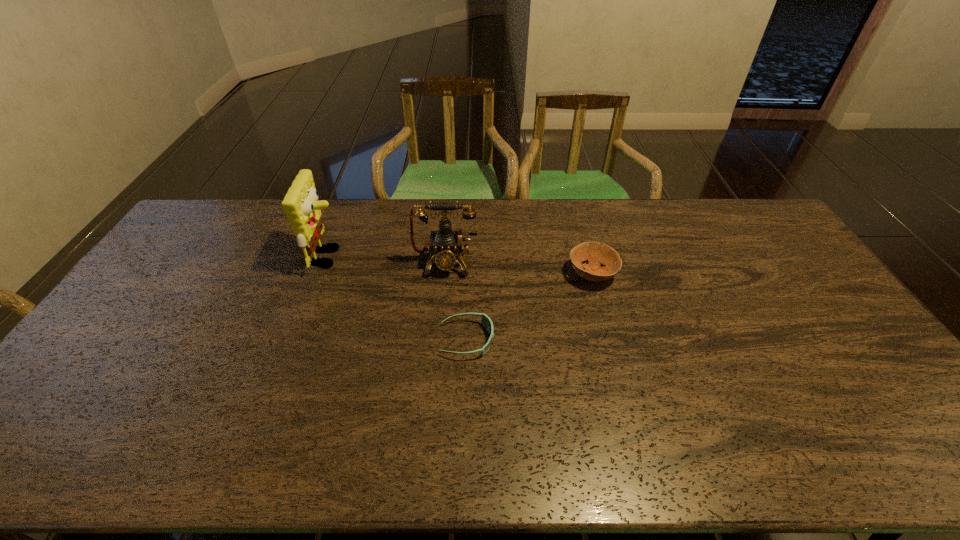
This screenshot has width=960, height=540. I want to click on the tallest object, so click(x=302, y=208).

In order to click on the leftmost object in this screenshot , I will do `click(302, 208)`.

The width and height of the screenshot is (960, 540). Find the location of `the third shortest object`. the third shortest object is located at coordinates (445, 244).

You are a GUI agent. You are given a task and a screenshot of the screen. Output one action in this format:
    pyautogui.click(x=<x>, y=<y>)
    Task: Click on the second shortest object
    Image resolution: width=960 pixels, height=540 pixels.
    Given the screenshot: What is the action you would take?
    pyautogui.click(x=595, y=253)

This screenshot has width=960, height=540. Identify the location of the rightmost object. (595, 253).

Locate an element on the screen. This screenshot has width=960, height=540. the shortest object is located at coordinates (485, 320).

This screenshot has width=960, height=540. I want to click on goggles, so click(x=485, y=320).

The height and width of the screenshot is (540, 960). In order to click on vacant region located on the face of the tallest object in this screenshot , I will do `click(394, 258)`.

Find the location of a particular element. This screenshot has width=960, height=540. vacant area situated on the front of the telephone, featuring the rotary dial is located at coordinates (441, 320).

At what (x,y) coordinates should I click in order to perform the action: click on free space located on the right of the bowl. Please return your answer as a coordinate pair (x, y). The image size is (960, 540). Looking at the image, I should click on (722, 274).